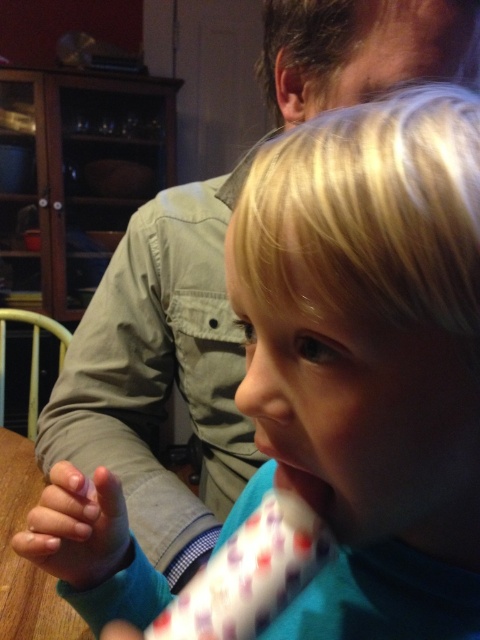
You are a photographer trying to capture a close shot of the wooden table at lower left. However, there is a smooth skin hand at lower left blocking part of it. Can you estimate whether the hand is small enough to not completely cover the table in the photo?

The smooth skin hand at lower left is smaller than wooden table at lower left, so the hand is small enough to not completely cover the table in the photo.

You are a photographer trying to capture a shot of the wooden table at lower left and the matte pink lips at center. Which object is located to the left of the other?

The wooden table at lower left is positioned on the left side of matte pink lips at center.

You are a photographer trying to capture a close portrait of the matte pink lips at center and the smooth skin hand at lower left. Which object should you focus on first if you want to ensure both are in focus?

The smooth skin hand at lower left is much taller as matte pink lips at center, so you should focus on the smooth skin hand at lower left first to ensure both are in focus.